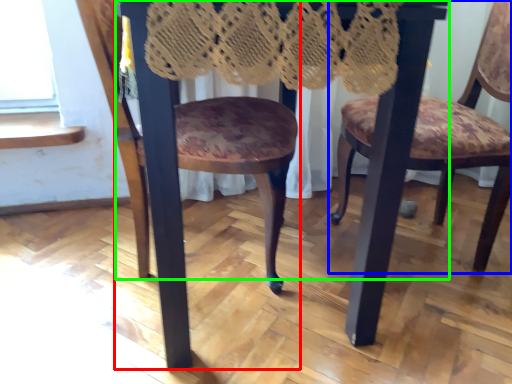
Question: Considering the real-world distances, which object is farthest from chair (highlighted by a red box)? chair (highlighted by a blue box) or table (highlighted by a green box)?

Choices:
 (A) chair
 (B) table

Answer: (A)